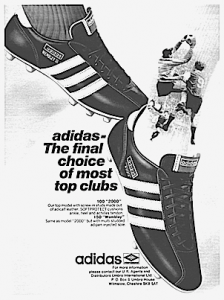
Find the location of a particular element. The height and width of the screenshot is (300, 224). sock is located at coordinates (194, 129), (173, 119), (208, 39), (58, 13).